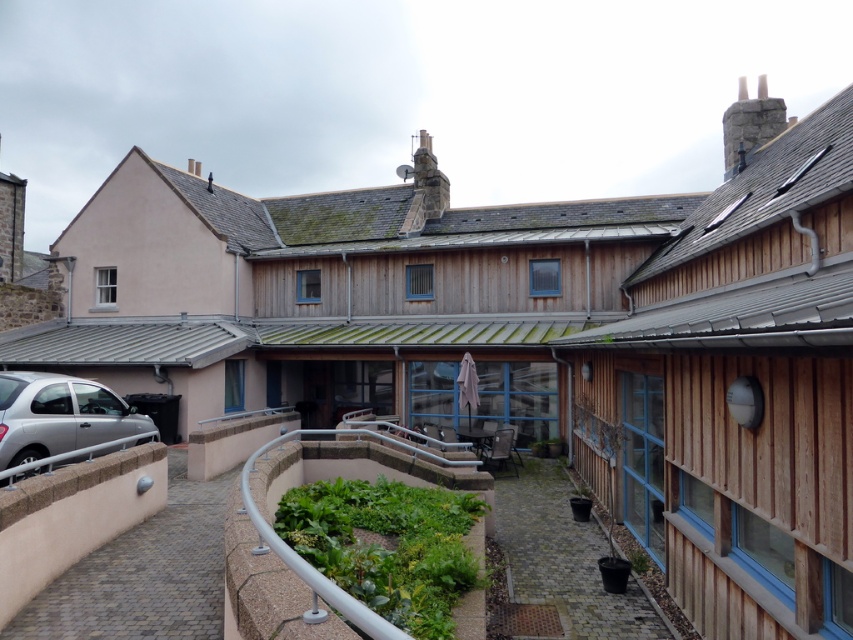
You are a gardener planning to move the silver metallic car at lower left to make space for more green leafy plants at center. Based on their sizes, which object occupies more horizontal space in the courtyard?

The green leafy plants at center are wider than the silver metallic car at lower left, so they occupy more horizontal space in the courtyard.

You are a delivery person needing to park your 2.5 meter long delivery van between the green leafy plants at center and the silver metallic car at lower left. Is there enough space?

The distance between the green leafy plants at center and the silver metallic car at lower left is 4.55 meters. Since your delivery van is 2.5 meters long, there is enough space to park it between them.